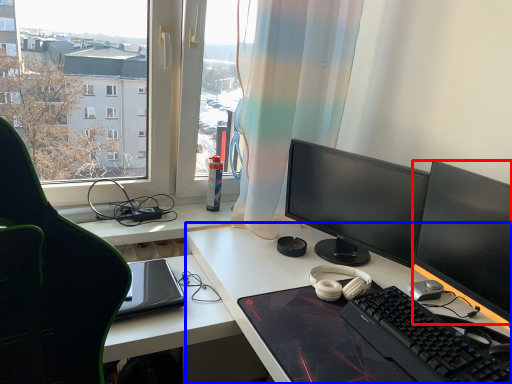
Question: Which of the following is the closest to the observer, computer monitor (highlighted by a red box) or desk (highlighted by a blue box)?

Choices:
 (A) computer monitor
 (B) desk

Answer: (B)